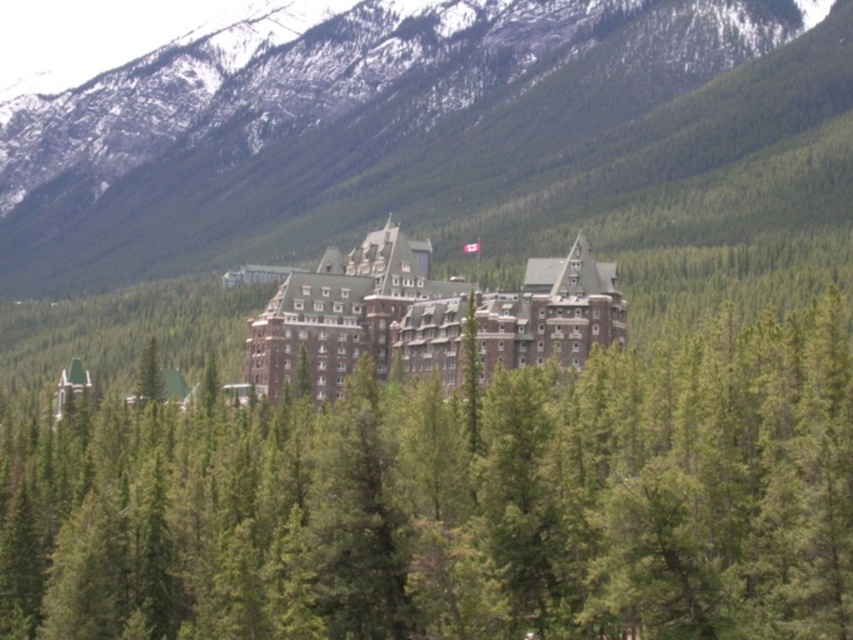
You are a visitor standing in front of the grand building and want to take a photo that includes both the green textured tree at center and the green forested mountain at upper center. Which object should you position closer to the edge of the frame to ensure both are fully visible?

Since the green textured tree at center is smaller than the green forested mountain at upper center, you should position the green textured tree at center closer to the edge of the frame to ensure both are fully visible.

You are standing in front of the brown brick hotel at center and want to take a photo of the green forested mountain at upper center. Can you see the mountain clearly through the hotel?

The green forested mountain at upper center is further to the viewer than the brown brick hotel at center, so the hotel is between you and the mountain. This means the mountain would be partially or fully obscured by the hotel when taking the photo.

You are a visitor standing in front of the brown brick hotel at center and looking towards the green textured tree at center. Which object is taller?

The green textured tree at center is much taller than the brown brick hotel at center.